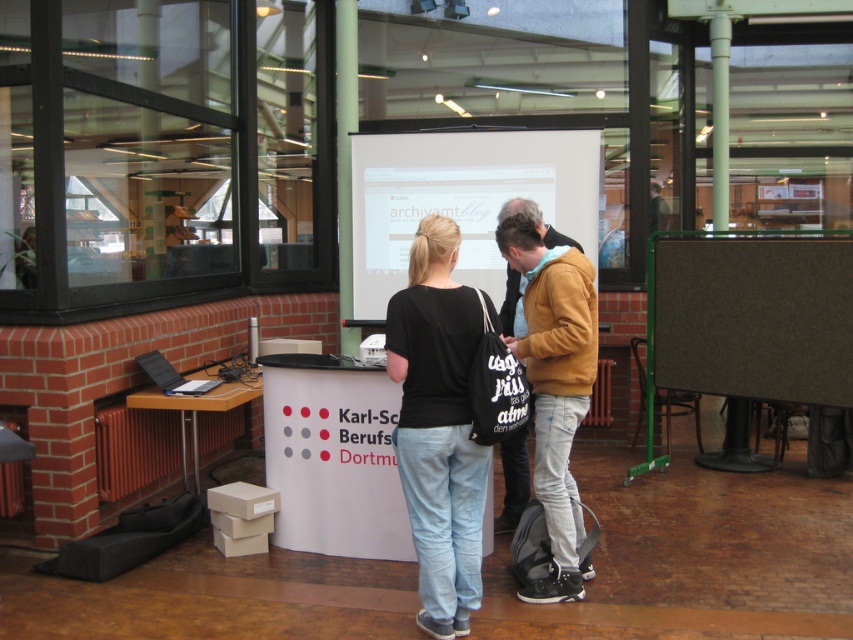
You are a photographer positioned to capture a group photo of the black cotton shirt at center and the matte yellow jacket at center. Considering their heights, which person should you place closer to the front to ensure both are visible in the photo?

The matte yellow jacket at center is shorter than the black cotton shirt at center, so you should position the matte yellow jacket at center closer to the front to avoid being obscured by the taller individual.

You are organizing a group photo and need to arrange two people, the black cotton shirt at center and the matte yellow jacket at center, so that they can both fit within a 1.2 meter wide frame. Based on their sizes, is this possible?

The black cotton shirt at center might be wider than matte yellow jacket at center, but since the exact width isn t specified, it s uncertain if they can both fit within 1.2 meters. Further measurement is needed.